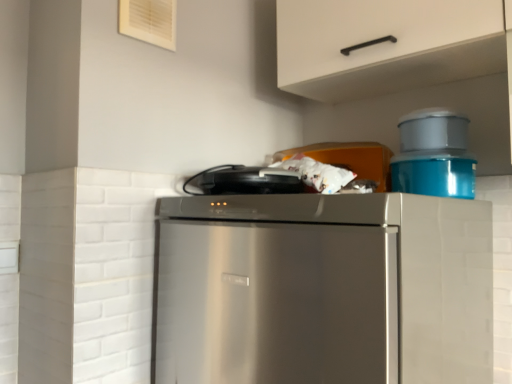
Question: From the image's perspective, is matte plastic container at upper right, placed as the 2th appliance when sorted from left to right, on top of white matte cabinet handle at upper center?

Choices:
 (A) no
 (B) yes

Answer: (A)

Question: Is matte plastic container at upper right, which appears as the second appliance when viewed from the right, facing towards white matte cabinet handle at upper center?

Choices:
 (A) no
 (B) yes

Answer: (A)

Question: Does matte plastic container at upper right, placed as the 2th appliance when sorted from left to right, have a larger size compared to white matte cabinet handle at upper center?

Choices:
 (A) no
 (B) yes

Answer: (A)

Question: Does matte plastic container at upper right, which appears as the second appliance when viewed from the right, have a lesser width compared to white matte cabinet handle at upper center?

Choices:
 (A) yes
 (B) no

Answer: (A)

Question: Is matte plastic container at upper right, which appears as the second appliance when viewed from the right, turned away from white matte cabinet handle at upper center?

Choices:
 (A) yes
 (B) no

Answer: (B)

Question: Is the depth of matte plastic container at upper right, placed as the 2th appliance when sorted from left to right, greater than that of white matte cabinet handle at upper center?

Choices:
 (A) no
 (B) yes

Answer: (B)

Question: From the image's perspective, does white matte cabinet handle at upper center appear lower than black matte toaster at upper center, acting as the first appliance starting from the left?

Choices:
 (A) no
 (B) yes

Answer: (A)

Question: Could you tell me if white matte cabinet handle at upper center is facing black matte toaster at upper center, acting as the first appliance starting from the left?

Choices:
 (A) yes
 (B) no

Answer: (B)

Question: From the image's perspective, is white matte cabinet handle at upper center over black matte toaster at upper center, acting as the first appliance starting from the left?

Choices:
 (A) yes
 (B) no

Answer: (A)

Question: Is black matte toaster at upper center, the 3th appliance when ordered from right to left, a part of white matte cabinet handle at upper center?

Choices:
 (A) no
 (B) yes

Answer: (A)

Question: Can you confirm if white matte cabinet handle at upper center is bigger than black matte toaster at upper center, acting as the first appliance starting from the left?

Choices:
 (A) no
 (B) yes

Answer: (B)

Question: Does white matte cabinet handle at upper center have a smaller size compared to black matte toaster at upper center, the 3th appliance when ordered from right to left?

Choices:
 (A) no
 (B) yes

Answer: (A)

Question: Would you say matte plastic container at upper right, which appears as the second appliance when viewed from the right, contains stainless steel refrigerator at center?

Choices:
 (A) yes
 (B) no

Answer: (B)